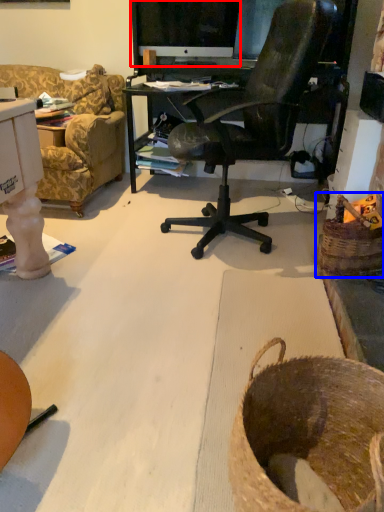
Question: Which of the following is the farthest to the observer, computer monitor (highlighted by a red box) or basket (highlighted by a blue box)?

Choices:
 (A) computer monitor
 (B) basket

Answer: (A)